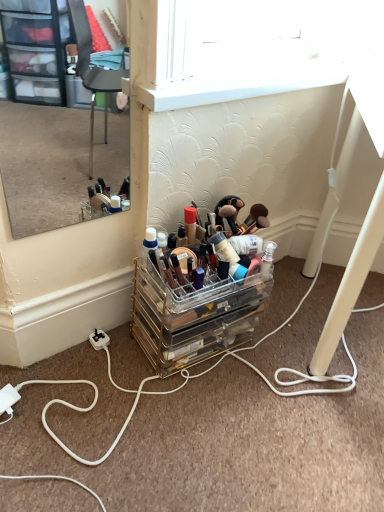
You are a GUI agent. You are given a task and a screenshot of the screen. Output one action in this format:
    pyautogui.click(x=<x>, y=<y>)
    Task: Click on the free space above white cord at lower left (from a real-world perspective)
    
    Given the screenshot: What is the action you would take?
    pyautogui.click(x=226, y=404)